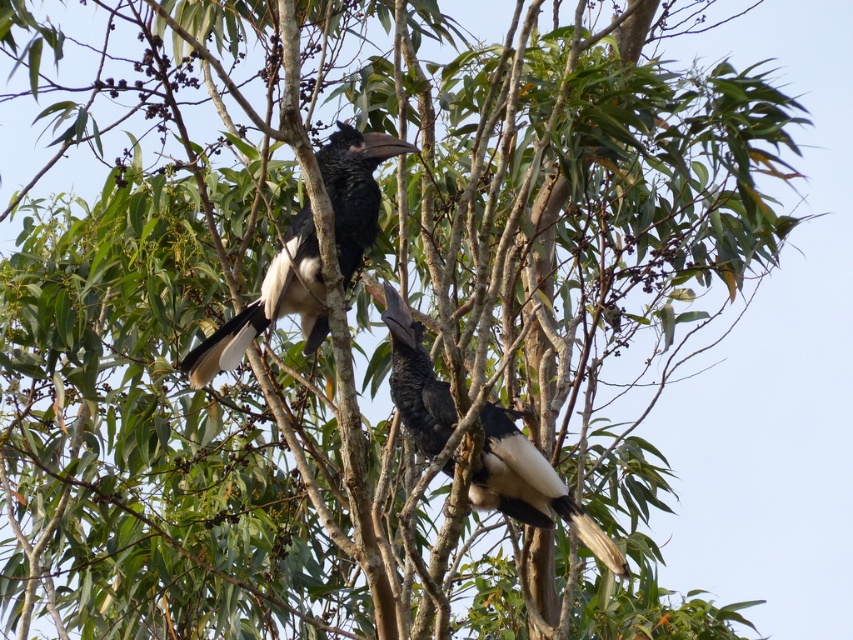
You are a birdwatcher observing two hornbills perched on a tree branch. You notice the black glossy hornbill at center and the black matte hornbill at center. Which of these two birds is the smaller one?

The black glossy hornbill at center is shorter than the black matte hornbill at center, so the black glossy hornbill at center is the smaller one.

You are a birdwatcher trying to locate the black glossy hornbill at center in the image. What are the coordinates of its position?

The black glossy hornbill at center is located at coordinates (270, 305).

You are a birdwatcher with a camera that has a zoom lens capable of focusing on objects up to 4 meters away. You spot two birds on a branch. The first bird is at point [370,179]. You want to take a photo of both birds clearly. Can your camera capture both birds in focus at the same time?

The two birds are 3.57 meters apart. Since your camera can focus up to 4 meters, yes, it can capture both birds in focus simultaneously.